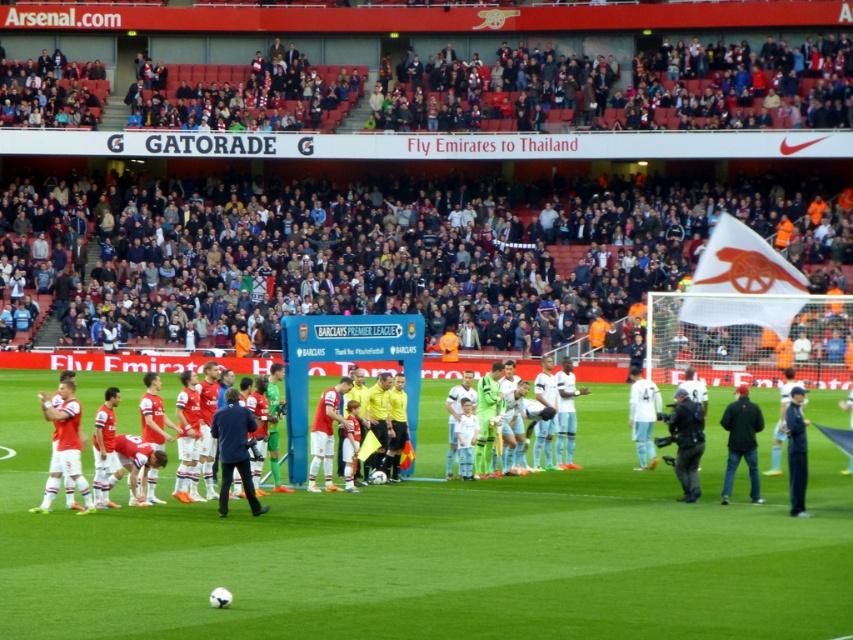
You are a drone operator trying to capture aerial footage of the football match at Emirates Stadium. The stadium has a rectangular pitch with a length of 105 meters and a width of 68 meters. Your drone is currently positioned above the point marked as point (434, 550), which is green grass at center. To ensure the best coverage, you need to determine the distance from this central point to the nearest edge of the pitch. Can you calculate this distance?

The point (434, 550) marks green grass at center. The nearest edge would be the shorter side since the pitch is longer from lengthwise. The distance from center to the nearest edge is half the width divided by 2? Wait, no. Wait, the center is at the midpoint of the pitch. The total width is 68 meters, so half the width is 34 meters. Therefore, the distance from the center to the nearest edge is 34 meters. Wait, but the coordinates might be normalized. Hmm, maybe the coordinates are normalized between 0 to

You are a spectator at the Emirates Stadium and see the white fabric flag at right and the white jersey at left. Which object is located more to the right side of the scene?

The white fabric flag at right is more to the right than the white jersey at left.

You are a photographer at Emirates Stadium during a football match. You need to capture a photo that includes both the green grass at center and the white fabric flag at right. Based on their positions, where should you position yourself to ensure both elements are visible in the frame?

Since the green grass at center is located below the white fabric flag at right, you should position yourself at a lower angle or closer to the ground to ensure both the green grass at center and the white fabric flag at right are visible in the frame.